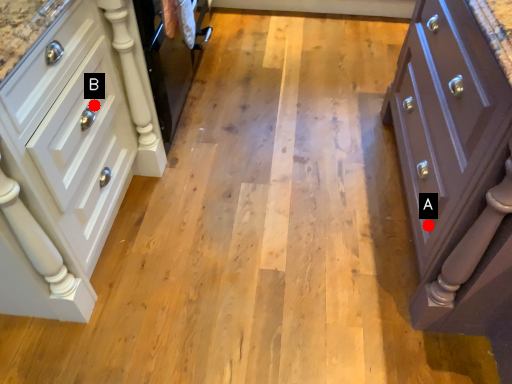
Question: Two points are circled on the image, labeled by A and B beside each circle. Among these points, which one is farthest from the camera?

Choices:
 (A) A is further
 (B) B is further

Answer: (A)